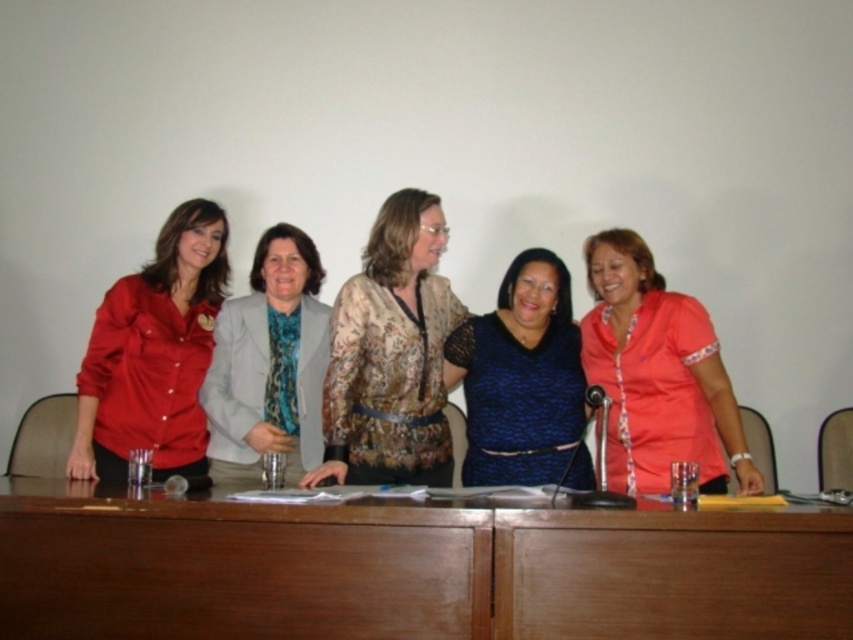
Question: Which of these objects is positioned farthest from the floral-patterned blouse at center?

Choices:
 (A) matte red blouse at left
 (B) blue textured dress at center
 (C) matte pink blouse at center
 (D) matte gray blazer at center

Answer: (C)

Question: Is brown wooden table at center thinner than matte red blouse at left?

Choices:
 (A) no
 (B) yes

Answer: (A)

Question: Can you confirm if matte red blouse at left is thinner than blue textured dress at center?

Choices:
 (A) yes
 (B) no

Answer: (A)

Question: Which object is the farthest from the matte red blouse at left?

Choices:
 (A) floral-patterned blouse at center
 (B) matte pink blouse at center
 (C) blue textured dress at center

Answer: (B)

Question: Which point appears farthest from the camera in this image?

Choices:
 (A) (392, 458)
 (B) (105, 432)
 (C) (604, 384)
 (D) (287, 371)

Answer: (D)

Question: Is the position of floral-patterned blouse at center more distant than that of blue textured dress at center?

Choices:
 (A) yes
 (B) no

Answer: (B)